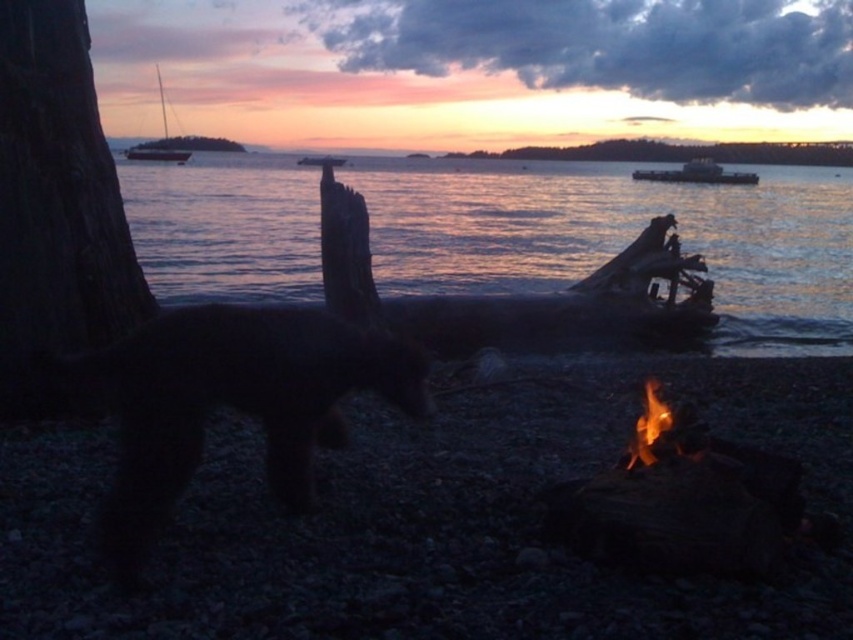
Can you confirm if smooth water at center is positioned below dark brown wood at left?

Incorrect, smooth water at center is not positioned below dark brown wood at left.

Can you confirm if smooth water at center is bigger than dark brown wood at left?

Indeed, smooth water at center has a larger size compared to dark brown wood at left.

Which is behind, point (772, 227) or point (80, 54)?

The point (772, 227) is behind.

The image size is (853, 640). What are the coordinates of `smooth water at center` in the screenshot? It's located at (619, 237).

Can you confirm if white sailboat at upper left is taller than metallic silver boat at center?

Correct, white sailboat at upper left is much taller as metallic silver boat at center.

Measure the distance between white sailboat at upper left and metallic silver boat at center.

They are 27.40 feet apart.

Locate an element on the screen. white sailboat at upper left is located at coordinates (160, 141).

Identify the location of white sailboat at upper left. The image size is (853, 640). (160, 141).

Who is lower down, flamematerial/texture at right or metallic silver boat at upper center?

flamematerial/texture at right is below.

Consider the image. Which is above, flamematerial/texture at right or metallic silver boat at upper center?

Positioned higher is metallic silver boat at upper center.

Which is in front, point (651, 388) or point (721, 172)?

Point (651, 388)

This screenshot has height=640, width=853. I want to click on flamematerial/texture at right, so click(648, 426).